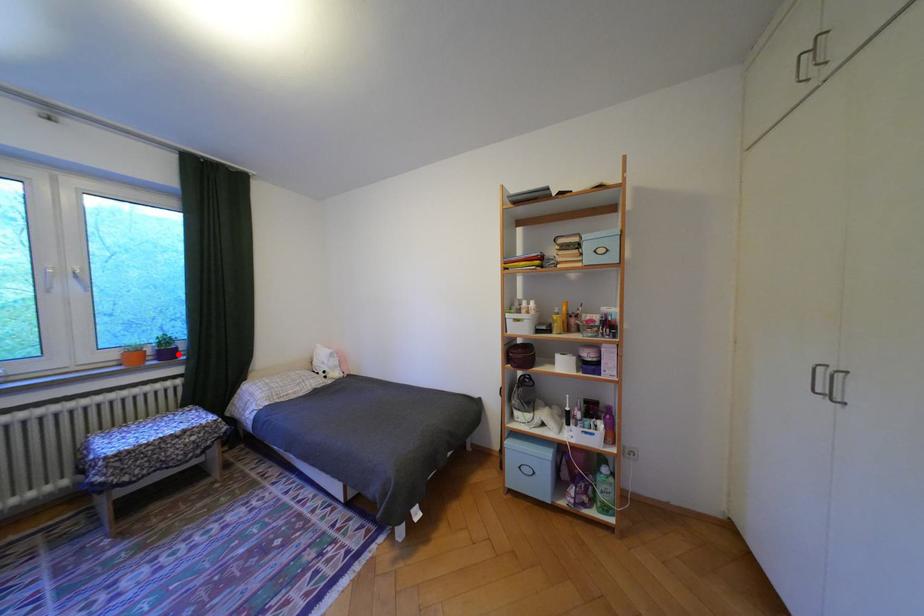
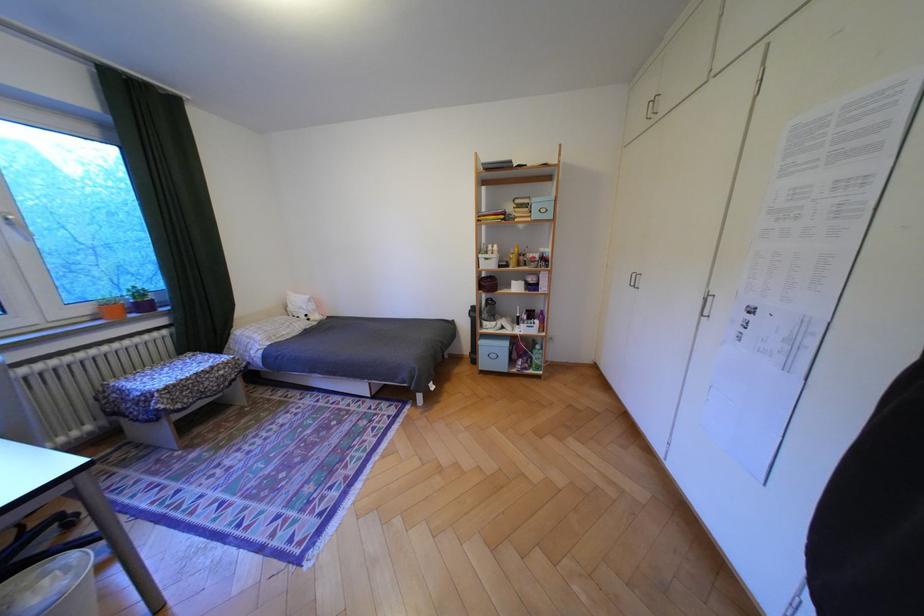
In the second image, find the point that corresponds to the highlighted location in the first image.

(155, 307)